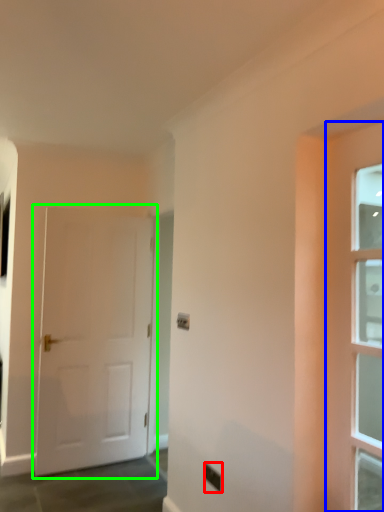
Question: Which object is the closest to the electric outlet (highlighted by a red box)? Choose among these: door (highlighted by a blue box) or door (highlighted by a green box).

Choices:
 (A) door
 (B) door

Answer: (A)